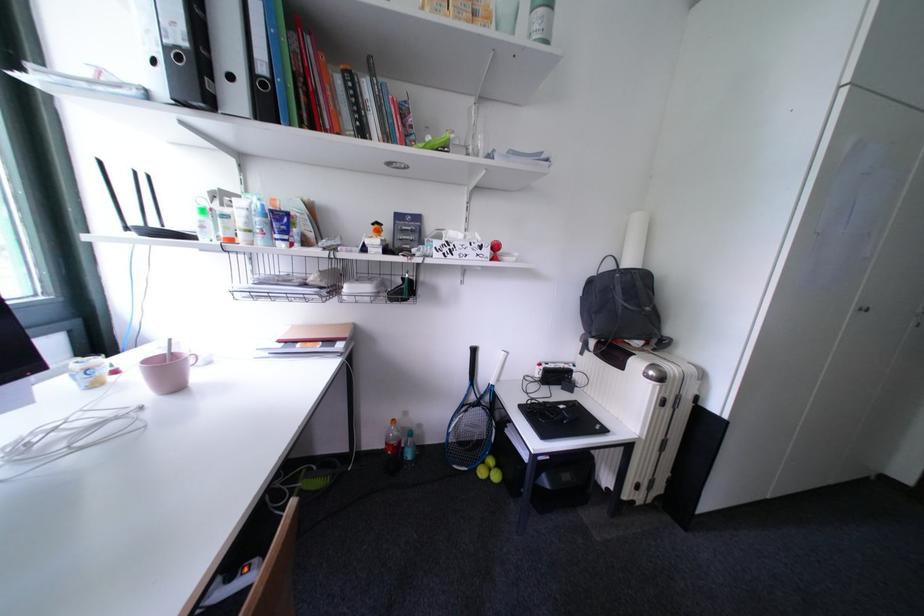
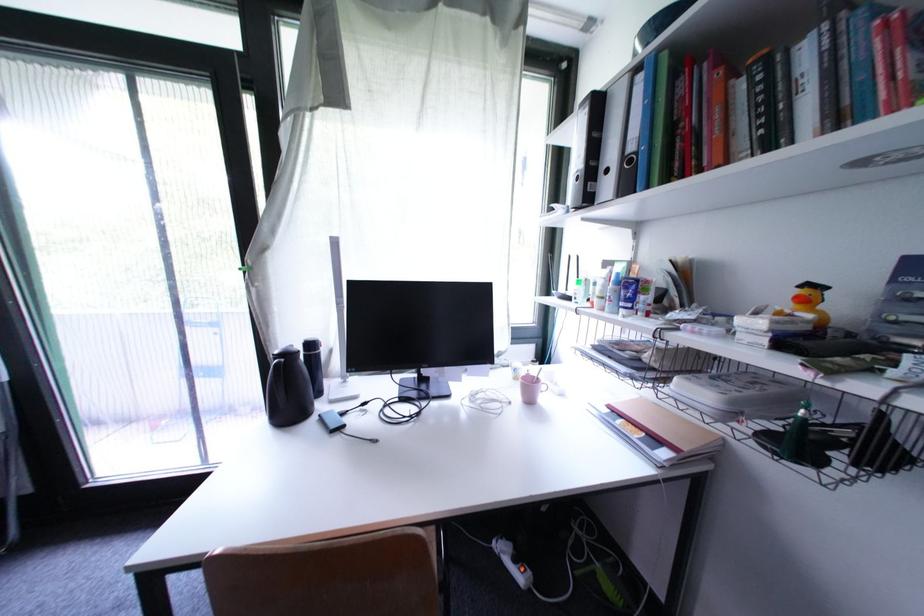
Question: The camera is either moving clockwise (left) or counter-clockwise (right) around the object. The first image is from the beginning of the video and the second image is from the end. Is the camera moving left or right when shooting the video?

Choices:
 (A) Left
 (B) Right

Answer: (B)